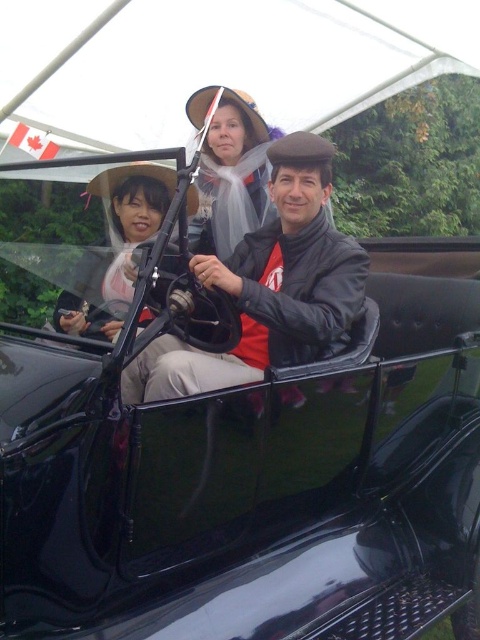
Question: Which point is closer to the camera taking this photo?

Choices:
 (A) (294, 364)
 (B) (141, 84)
 (C) (146, 228)
 (D) (262, 120)

Answer: (C)

Question: Is white fabric canopy at upper center wider than matte white veil at center?

Choices:
 (A) no
 (B) yes

Answer: (B)

Question: From the image, what is the correct spatial relationship of matte white veil at center in relation to matte black car at left?

Choices:
 (A) below
 (B) above

Answer: (B)

Question: Is white fabric canopy at upper center above matte black jacket at center?

Choices:
 (A) yes
 (B) no

Answer: (A)

Question: Which object appears farthest from the camera in this image?

Choices:
 (A) matte white veil at center
 (B) white fabric canopy at upper center

Answer: (B)

Question: Estimate the real-world distances between objects in this image. Which object is closer to the matte white veil at center?

Choices:
 (A) matte black car at left
 (B) white fabric canopy at upper center
 (C) matte black jacket at center

Answer: (C)